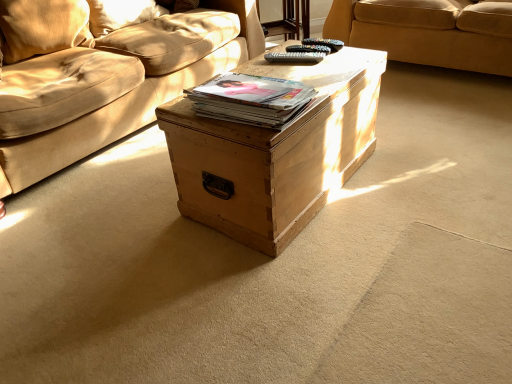
Question: From a real-world perspective, is natural wood trunk at center positioned above or below velvet beige pillow at upper left, which is the first pillow in front-to-back order?

Choices:
 (A) above
 (B) below

Answer: (B)

Question: Is natural wood trunk at center bigger or smaller than velvet beige pillow at upper left, which is the first pillow in front-to-back order?

Choices:
 (A) big
 (B) small

Answer: (A)

Question: Which object is positioned farthest from the black plastic remote at center?

Choices:
 (A) natural wood trunk at center
 (B) soft beige pillow at upper left, the second pillow viewed from the front
 (C) beige fabric couch at upper center
 (D) velvet beige pillow at upper left, the second pillow in the back-to-front sequence
 (E) matte brown book at center

Answer: (C)

Question: Which of these objects is positioned farthest from the natural wood trunk at center?

Choices:
 (A) soft beige pillow at upper left, the second pillow viewed from the front
 (B) beige fabric couch at upper center
 (C) matte brown book at center
 (D) velvet beige pillow at upper left, the second pillow in the back-to-front sequence
 (E) black plastic remote at center

Answer: (B)